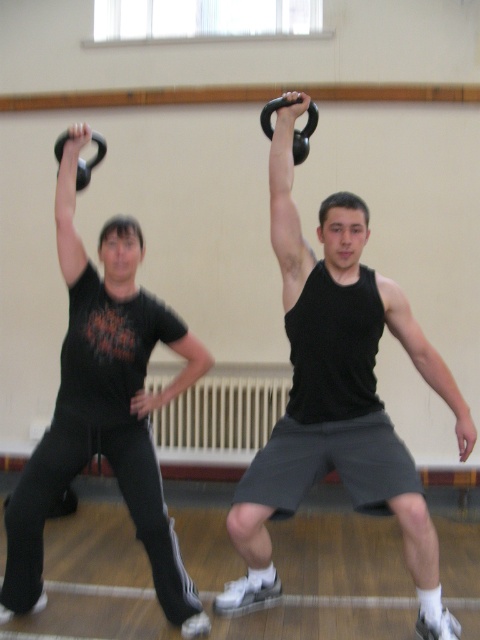
Question: Which point is farther to the camera?

Choices:
 (A) black matte t-shirt at center
 (B) matte black kettlebell at upper center

Answer: (A)

Question: Can you confirm if black matte arm at upper center is positioned to the left of matte black kettlebell at upper left?

Choices:
 (A) no
 (B) yes

Answer: (A)

Question: Which object appears farthest from the camera in this image?

Choices:
 (A) black matte tank top at upper center
 (B) black matte arm at upper center
 (C) black rubber kettlebell at upper center
 (D) black matte t-shirt at center

Answer: (D)

Question: Is matte black kettlebell at upper left wider than black rubber barbell at upper left?

Choices:
 (A) no
 (B) yes

Answer: (A)

Question: Is matte black kettlebell at upper center wider than black matte t-shirt at center?

Choices:
 (A) no
 (B) yes

Answer: (B)

Question: Which of these objects is positioned closest to the matte black kettlebell at upper center?

Choices:
 (A) black matte t-shirt at center
 (B) black rubber barbell at upper left

Answer: (A)